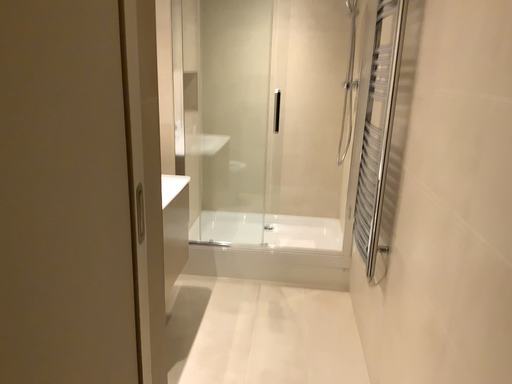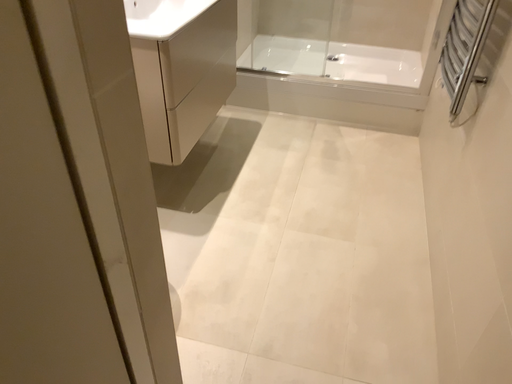
Question: How did the camera likely rotate when shooting the video?

Choices:
 (A) rotated left
 (B) rotated right

Answer: (A)